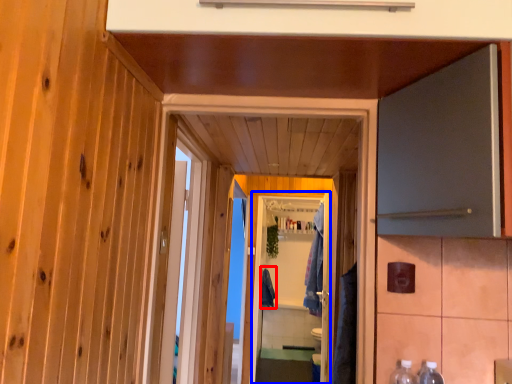
Question: Which point is closer to the camera, robe (highlighted by a red box) or screen door (highlighted by a blue box)?

Choices:
 (A) robe
 (B) screen door

Answer: (B)